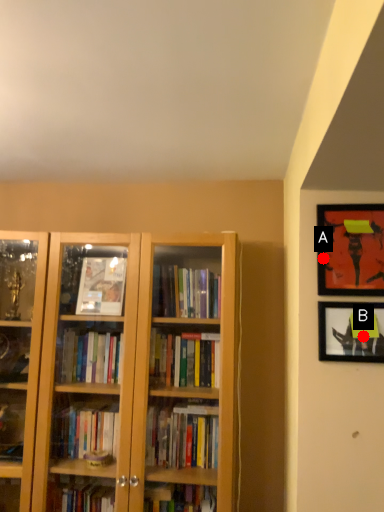
Question: Two points are circled on the image, labeled by A and B beside each circle. Which point is closer to the camera?

Choices:
 (A) A is closer
 (B) B is closer

Answer: (B)